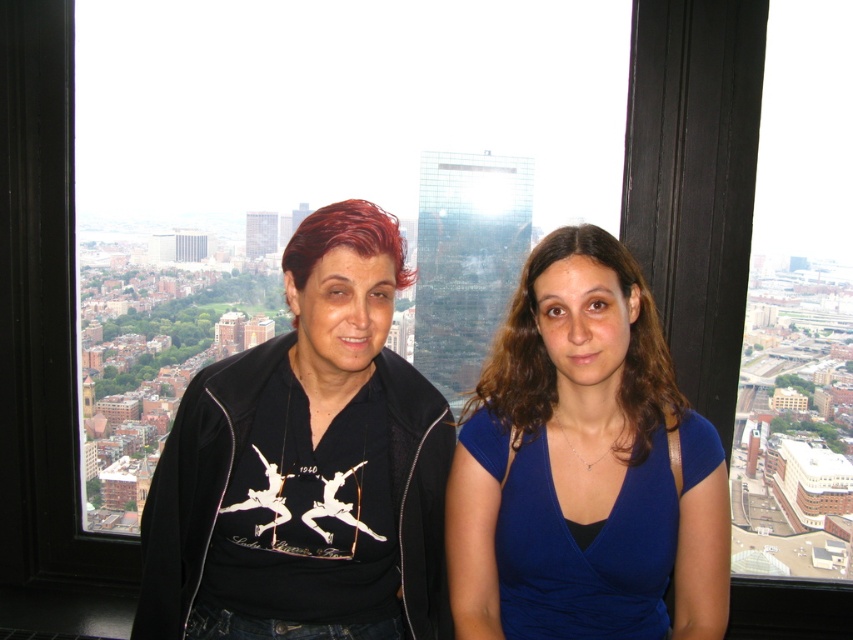
You are a photographer planning to take a group photo of the black matte shirt at center and the blue velvet dress at center. The camera you are using has a maximum focus range of 60 feet. Will both subjects be in focus if you position the camera exactly between them?

The distance between the black matte shirt at center and the blue velvet dress at center is 62.09 feet. Since the camera can focus up to 60 feet, positioning it exactly between them would mean each subject is 31.045 feet away from the camera. This distance is within the focus range, so both will be in focus.

You are a fashion designer observing two outfits in an image. You see a black matte shirt at center and a blue velvet dress at center. Which clothing item is wider?

The black matte shirt at center is wider than the blue velvet dress at center according to the description.

You are a drone operator trying to deliver a package to a point marked at coordinates [634,493] in the image. The drone can only fly up to 500 meters. Based on the scene, can the drone reach the point?

The point at [634,493] is 535.46 meters away from the camera, which exceeds the drone maximum range of 500 meters. Therefore, the drone cannot reach the point.